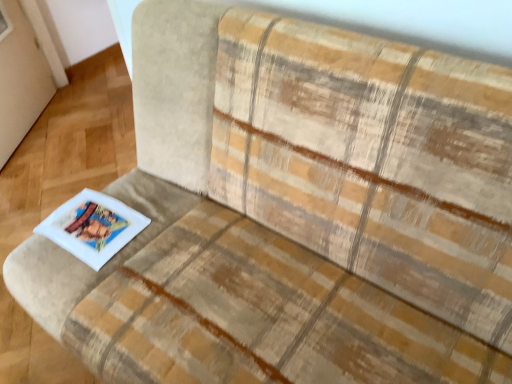
You are a GUI agent. You are given a task and a screenshot of the screen. Output one action in this format:
    pyautogui.click(x=<x>, y=<y>)
    Task: Click on the empty space that is ontop of white glossy book at lower left (from a real-world perspective)
    
    Given the screenshot: What is the action you would take?
    pyautogui.click(x=84, y=222)